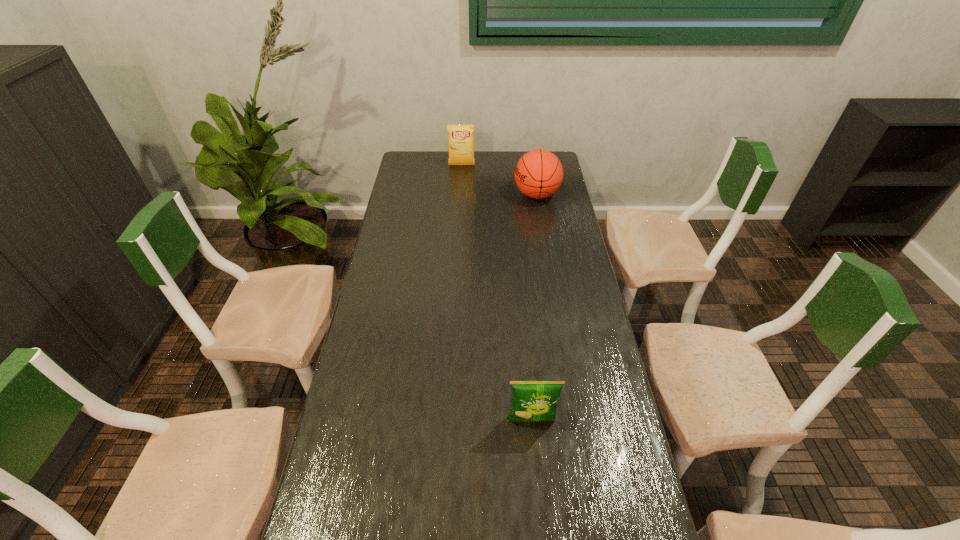
I want to click on object that is at the far edge, so click(460, 137).

Locate an element on the screen. This screenshot has width=960, height=540. object present at the right edge is located at coordinates [538, 174].

Image resolution: width=960 pixels, height=540 pixels. Find the location of `free space at the left edge of the desktop`. free space at the left edge of the desktop is located at coordinates (389, 260).

Locate an element on the screen. free space at the right edge of the desktop is located at coordinates (557, 285).

In the image, there is a desktop. Where is `vacant space at the far left corner`? vacant space at the far left corner is located at coordinates (419, 173).

This screenshot has height=540, width=960. In order to click on free space between the farthest object and the second farthest object in this screenshot , I will do `click(499, 180)`.

The image size is (960, 540). In order to click on free space between the basketball and the nearest object in this screenshot , I will do `click(534, 307)`.

At what (x,y) coordinates should I click in order to perform the action: click on free area in between the farthest object and the second farthest object. Please return your answer as a coordinate pair (x, y). Looking at the image, I should click on (499, 180).

Where is `vacant space that is in between the left crisp (potato chip) and the right crisp (potato chip)`? The image size is (960, 540). vacant space that is in between the left crisp (potato chip) and the right crisp (potato chip) is located at coordinates (496, 293).

This screenshot has width=960, height=540. What are the coordinates of `free point between the farther crisp (potato chip) and the right crisp (potato chip)` in the screenshot? It's located at (496, 293).